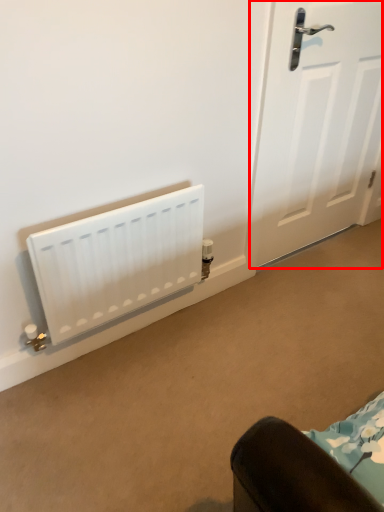
Question: From the image's perspective, what is the correct spatial relationship of door (annotated by the red box) in relation to radiator?

Choices:
 (A) below
 (B) above

Answer: (B)